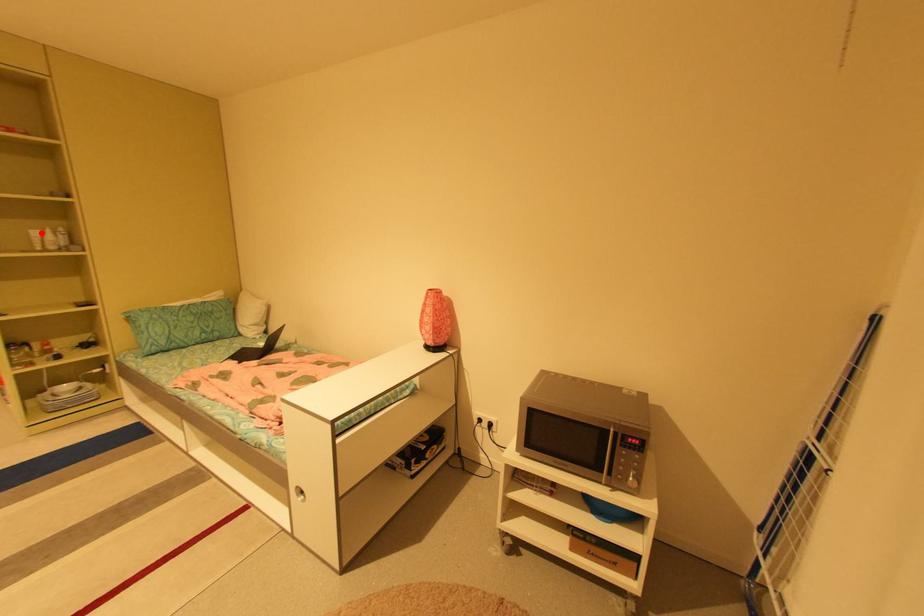
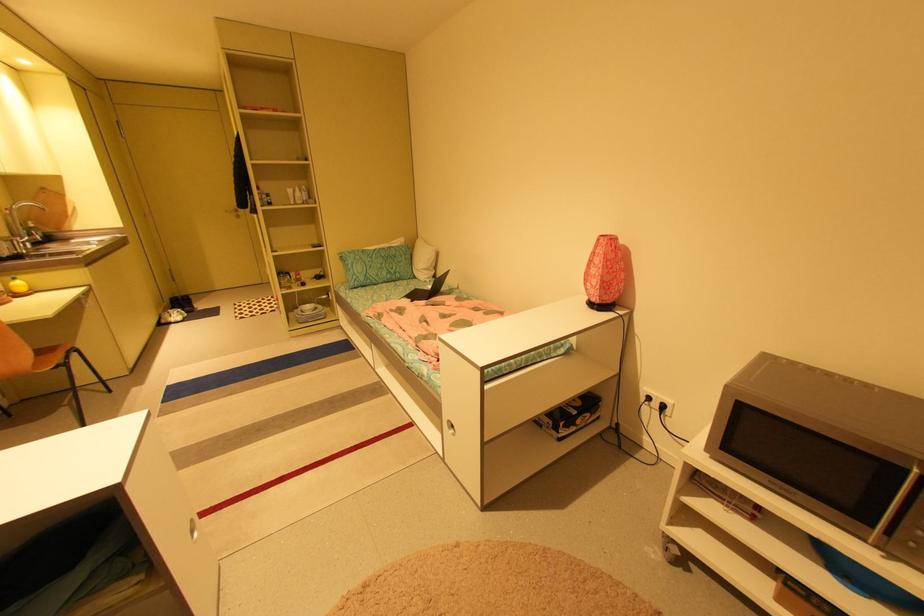
The point at the highlighted location is marked in the first image. Where is the corresponding point in the second image?

(296, 191)